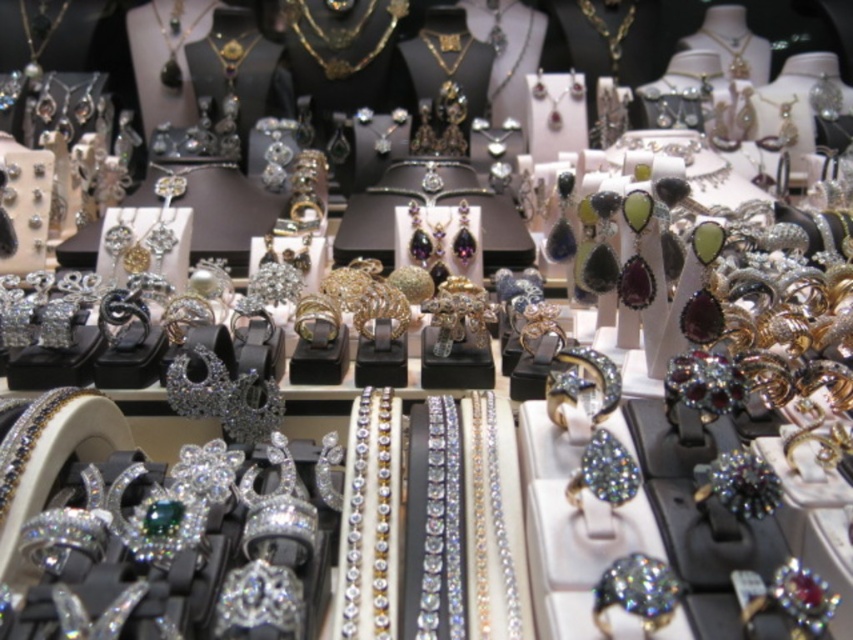
Question: Is matte black necklace at upper center below gold shiny necklace at center?

Choices:
 (A) no
 (B) yes

Answer: (A)

Question: Which point is closer to the camera taking this photo?

Choices:
 (A) (171, 65)
 (B) (440, 49)

Answer: (B)

Question: Which of the following is the closest to the observer?

Choices:
 (A) matte black necklace at upper center
 (B) gold shiny necklace at center

Answer: (B)

Question: Can you confirm if matte black necklace at upper center is wider than gold shiny necklace at center?

Choices:
 (A) yes
 (B) no

Answer: (A)

Question: Does matte black necklace at upper center appear on the left side of gold shiny necklace at center?

Choices:
 (A) yes
 (B) no

Answer: (A)